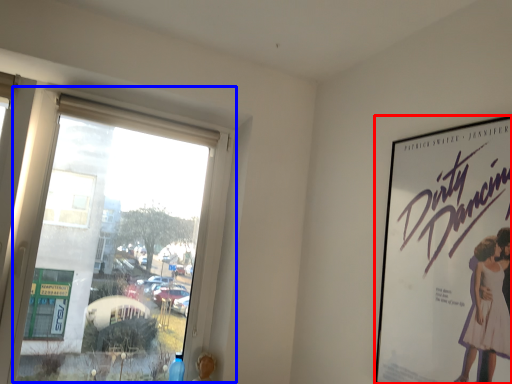
Question: Which object appears farthest to the camera in this image, poster (highlighted by a red box) or window (highlighted by a blue box)?

Choices:
 (A) poster
 (B) window

Answer: (B)